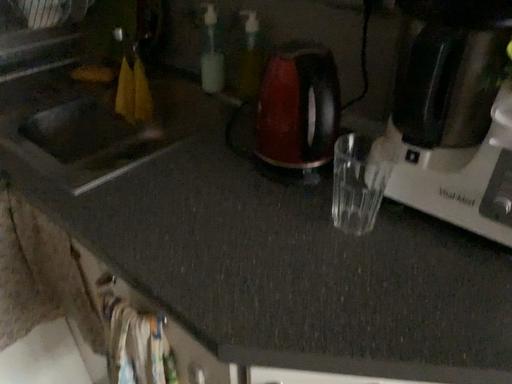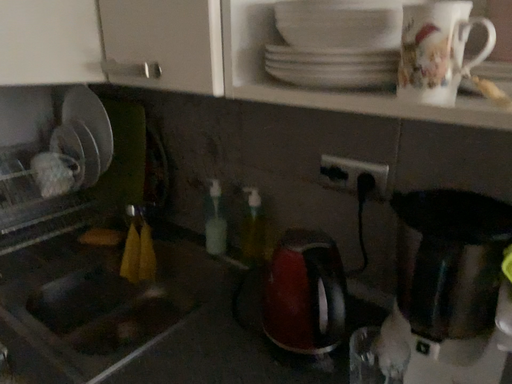
Question: How did the camera likely rotate when shooting the video?

Choices:
 (A) rotated upward
 (B) rotated downward

Answer: (A)